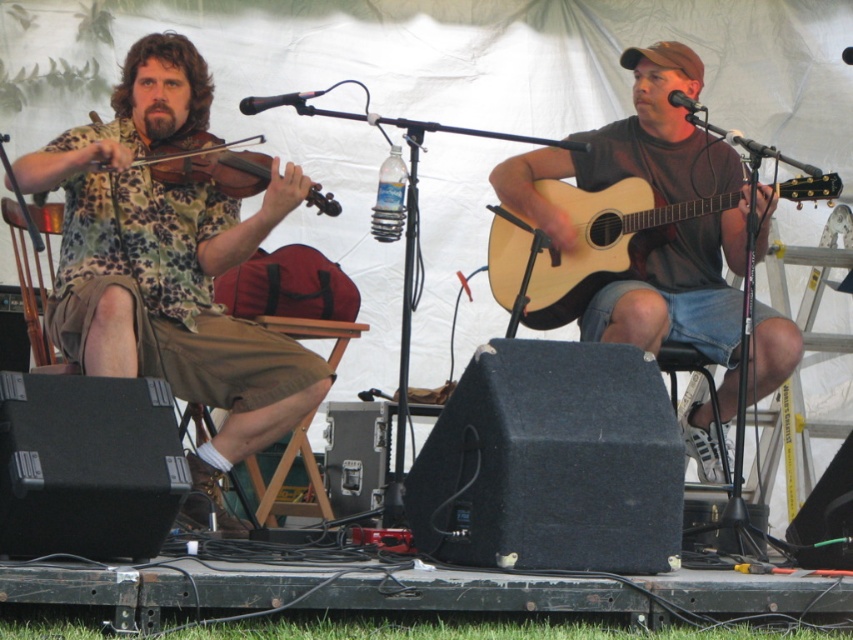
At what (x,y) coordinates should I click in order to perform the action: click on camouflage shirt at left. Please return your answer as a coordinate pair (x, y). This screenshot has width=853, height=640. Looking at the image, I should click on (167, 260).

This screenshot has width=853, height=640. Describe the element at coordinates (167, 260) in the screenshot. I see `camouflage shirt at left` at that location.

Image resolution: width=853 pixels, height=640 pixels. I want to click on camouflage shirt at left, so click(167, 260).

Between matte brown guitar at center and matte black violin at left, which one is positioned lower?

Positioned lower is matte brown guitar at center.

What do you see at coordinates (630, 147) in the screenshot?
I see `matte brown guitar at center` at bounding box center [630, 147].

Identify the location of matte brown guitar at center. The width and height of the screenshot is (853, 640). (630, 147).

Does natural wood acoustic guitar at right appear on the right side of matte black violin at left?

Indeed, natural wood acoustic guitar at right is positioned on the right side of matte black violin at left.

Is point (567, 296) positioned before point (161, 173)?

No, (567, 296) is further to viewer.

This screenshot has height=640, width=853. Describe the element at coordinates (585, 244) in the screenshot. I see `natural wood acoustic guitar at right` at that location.

Image resolution: width=853 pixels, height=640 pixels. In order to click on natural wood acoustic guitar at right in this screenshot , I will do `click(585, 244)`.